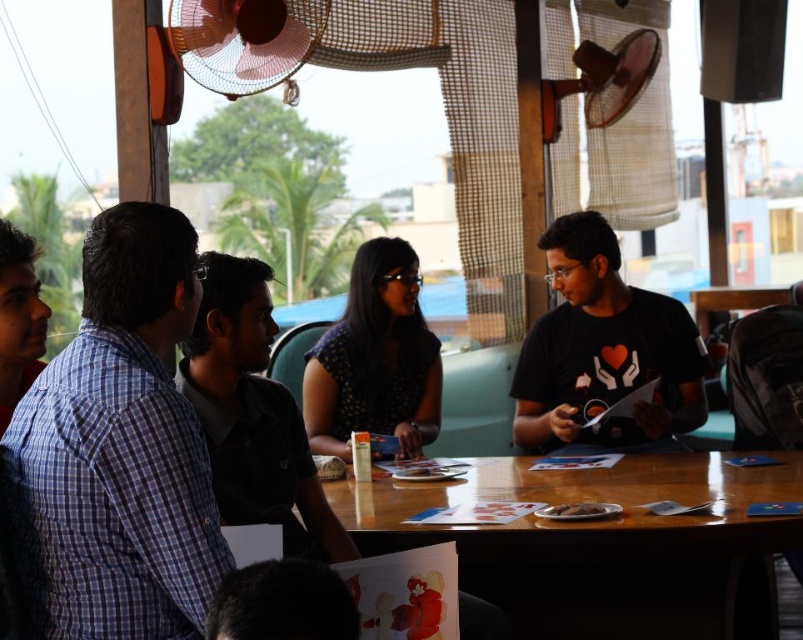
Does wooden table at center have a lesser height compared to smooth black hair at lower center?

No.

Measure the distance between wooden table at center and camera.

wooden table at center and camera are 6.39 feet apart from each other.

Image resolution: width=803 pixels, height=640 pixels. What are the coordinates of `wooden table at center` in the screenshot? It's located at (602, 545).

Can you confirm if dark blue dotted dress at center is smaller than matte blue shirt at left?

No, dark blue dotted dress at center is not smaller than matte blue shirt at left.

Between dark blue dotted dress at center and matte blue shirt at left, which one is positioned lower?

dark blue dotted dress at center is lower down.

What do you see at coordinates (374, 358) in the screenshot? I see `dark blue dotted dress at center` at bounding box center [374, 358].

The width and height of the screenshot is (803, 640). What are the coordinates of `dark blue dotted dress at center` in the screenshot? It's located at (374, 358).

The image size is (803, 640). What do you see at coordinates (282, 604) in the screenshot?
I see `smooth black hair at lower center` at bounding box center [282, 604].

Which is more to the right, smooth black hair at lower center or metallic silver fan at upper right?

Positioned to the right is metallic silver fan at upper right.

Which is behind, point (218, 586) or point (642, 61)?

Positioned behind is point (642, 61).

Find the location of a particular element. This screenshot has height=640, width=803. smooth black hair at lower center is located at coordinates (282, 604).